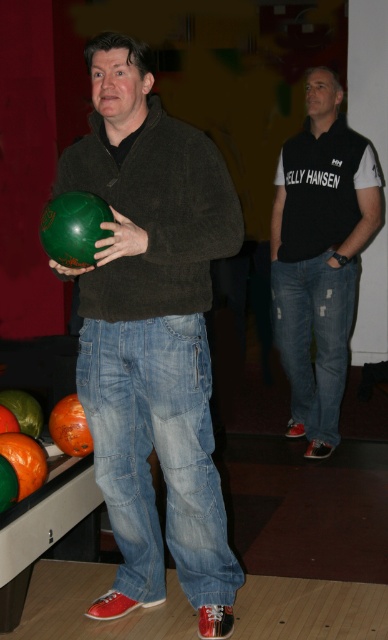
Question: Which point is farther to the camera?

Choices:
 (A) black jersey at center
 (B) matte green bowling ball at left
 (C) light blue denim jeans at center
 (D) ripped denim jeans at center

Answer: (D)

Question: Which object is farther from the camera taking this photo?

Choices:
 (A) light blue denim jeans at center
 (B) green matte bowling ball at center
 (C) ripped denim jeans at center

Answer: (C)

Question: Is matte green bowling ball at left below green matte bowling ball at center?

Choices:
 (A) yes
 (B) no

Answer: (A)

Question: Is the position of ripped denim jeans at center less distant than that of green matte bowling ball at center?

Choices:
 (A) yes
 (B) no

Answer: (B)

Question: Does matte green bowling ball at left appear over light blue denim jeans at center?

Choices:
 (A) yes
 (B) no

Answer: (A)

Question: Among these points, which one is farthest from the camera?

Choices:
 (A) (60, 241)
 (B) (325, 298)
 (C) (183, 161)

Answer: (B)